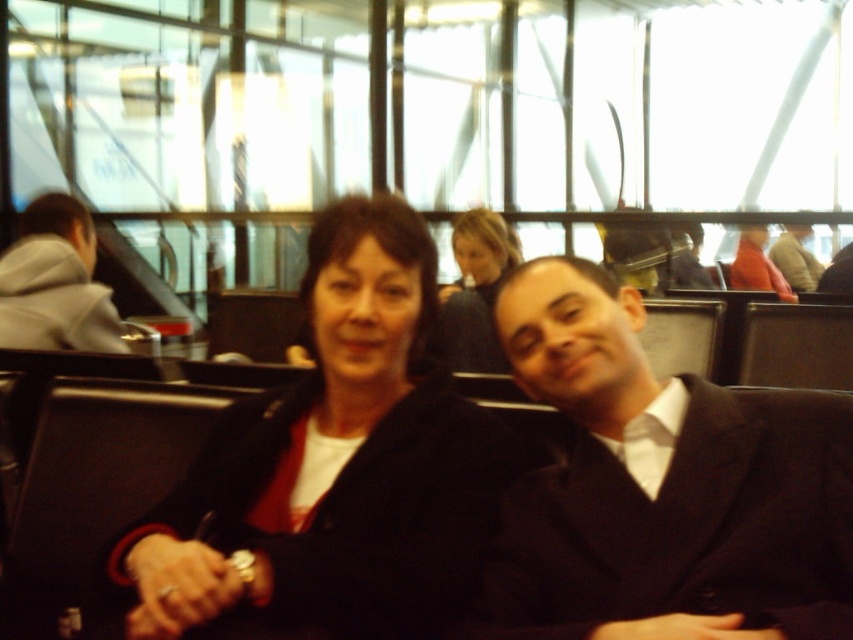
Does black matte suit at center have a greater height compared to smooth black hair at center?

In fact, black matte suit at center may be shorter than smooth black hair at center.

Does point (631, 602) come behind point (479, 332)?

That is False.

Which is behind, point (799, 515) or point (503, 365)?

Point (503, 365)

The image size is (853, 640). In order to click on black matte suit at center in this screenshot , I will do `click(662, 486)`.

Is the position of matte black jacket at center more distant than that of black matte suit at center?

Yes, it is.

Is matte black jacket at center wider than black matte suit at center?

Yes, matte black jacket at center is wider than black matte suit at center.

Image resolution: width=853 pixels, height=640 pixels. In order to click on matte black jacket at center in this screenshot , I will do `click(334, 465)`.

The image size is (853, 640). What are the coordinates of `matte black jacket at center` in the screenshot? It's located at (334, 465).

Is point (520, 502) more distant than point (65, 336)?

No, it is in front of (65, 336).

Can you confirm if black matte suit at center is wider than gray hoodie at left?

Indeed, black matte suit at center has a greater width compared to gray hoodie at left.

This screenshot has height=640, width=853. What are the coordinates of `black matte suit at center` in the screenshot? It's located at (662, 486).

Image resolution: width=853 pixels, height=640 pixels. Find the location of `black matte suit at center`. black matte suit at center is located at coordinates coord(662,486).